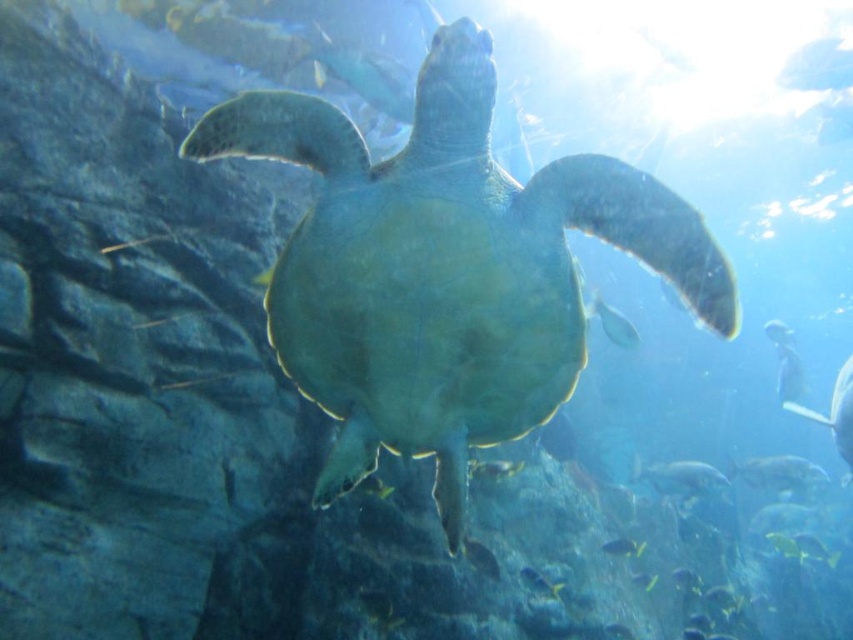
Is translucent white fish at lower right thinner than shiny silver fish at center?

Incorrect, translucent white fish at lower right's width is not less than shiny silver fish at center's.

Who is taller, translucent white fish at lower right or shiny silver fish at center?

translucent white fish at lower right

Is point (824, 472) farther from camera compared to point (467, 548)?

Yes, it is.

Find the location of a particular element. translucent white fish at lower right is located at coordinates (778, 472).

Between shiny silver fish at center and translucent blue fish at center, which one is positioned lower?

translucent blue fish at center

Does point (486, 566) come closer to viewer compared to point (546, 582)?

Yes, it is in front of point (546, 582).

Locate an element on the screen. The height and width of the screenshot is (640, 853). shiny silver fish at center is located at coordinates (480, 557).

Can you confirm if translucent blue fish at upper right is shorter than translucent blue fish at center?

In fact, translucent blue fish at upper right may be taller than translucent blue fish at center.

Between translucent blue fish at upper right and translucent blue fish at center, which one is positioned higher?

translucent blue fish at upper right is higher up.

Is point (622, 324) more distant than point (547, 584)?

Yes, point (622, 324) is farther from viewer.

You are a GUI agent. You are given a task and a screenshot of the screen. Output one action in this format:
    pyautogui.click(x=<x>, y=<y>)
    Task: Click on the translucent blue fish at upper right
    
    Given the screenshot: What is the action you would take?
    pyautogui.click(x=613, y=323)